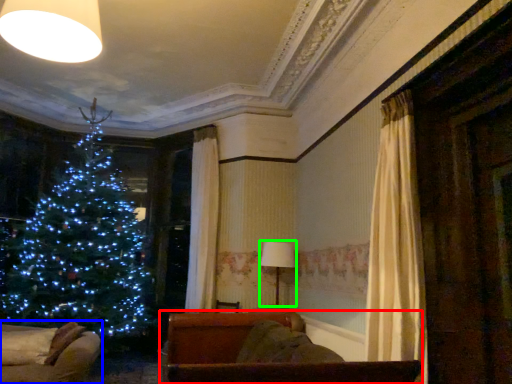
Question: Based on their relative distances, which object is farther from furniture (highlighted by a red box)? Choose from furniture (highlighted by a blue box) and lamp (highlighted by a green box).

Choices:
 (A) furniture
 (B) lamp

Answer: (B)